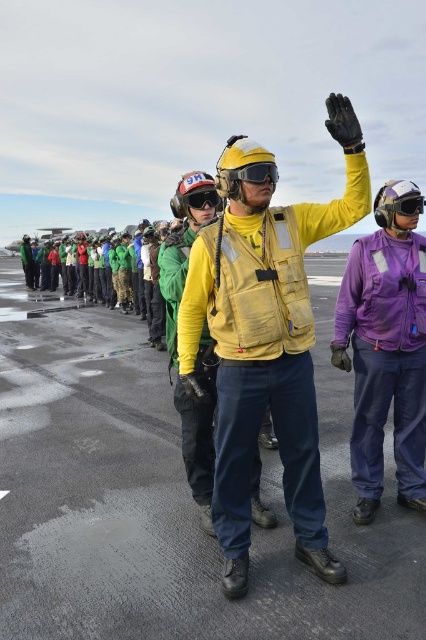
Is black matte goggles at center closer to camera compared to matte black goggles at upper right?

Yes, black matte goggles at center is in front of matte black goggles at upper right.

Which is more to the right, black matte goggles at center or matte black goggles at upper right?

matte black goggles at upper right

Is point (201, 195) positioned before point (408, 195)?

No, it is not.

The height and width of the screenshot is (640, 426). I want to click on black matte goggles at center, so click(201, 198).

Can you confirm if glossy asphalt tarmac at center is positioned below matte black goggles at upper right?

Correct, glossy asphalt tarmac at center is located below matte black goggles at upper right.

Which is more to the right, glossy asphalt tarmac at center or matte black goggles at upper right?

matte black goggles at upper right

You are a GUI agent. You are given a task and a screenshot of the screen. Output one action in this format:
    pyautogui.click(x=<x>, y=<y>)
    Task: Click on the glossy asphalt tarmac at center
    Image resolution: width=426 pixels, height=640 pixels.
    Given the screenshot: What is the action you would take?
    point(166,497)

Consider the image. Which is more to the right, yellow fabric vest at center or matte black goggles at center?

From the viewer's perspective, yellow fabric vest at center appears more on the right side.

Based on the photo, between yellow fabric vest at center and matte black goggles at center, which one has more height?

With more height is yellow fabric vest at center.

Is point (279, 444) positioned before point (244, 170)?

No, it is behind (244, 170).

The height and width of the screenshot is (640, 426). I want to click on yellow fabric vest at center, so click(x=256, y=444).